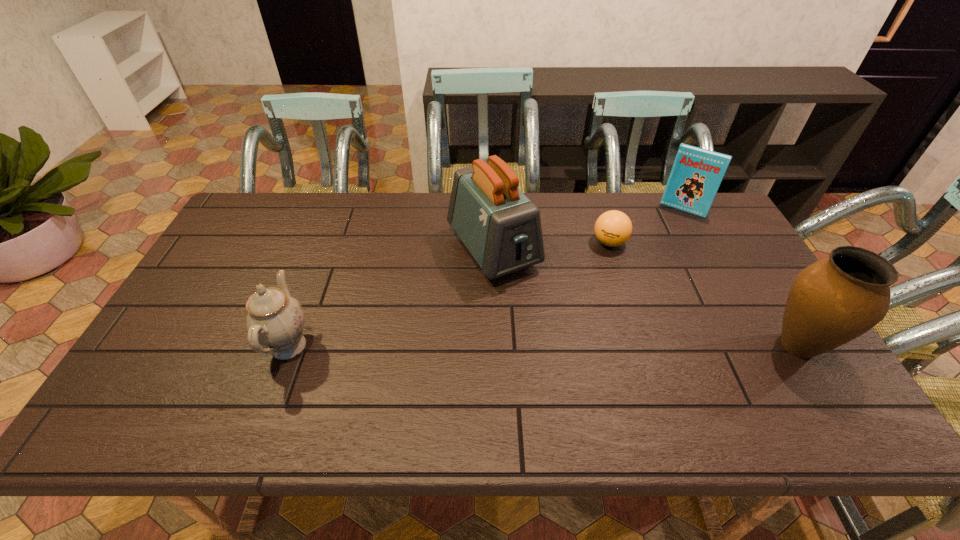
Image resolution: width=960 pixels, height=540 pixels. Find the location of `the leftmost object`. the leftmost object is located at coordinates click(274, 319).

The image size is (960, 540). Identify the location of urn. (831, 302).

The width and height of the screenshot is (960, 540). Find the location of `the shortest object`. the shortest object is located at coordinates (613, 228).

What are the coordinates of `the third object from left to right` in the screenshot? It's located at (613, 228).

Where is `the fourth object from right to left`? This screenshot has width=960, height=540. the fourth object from right to left is located at coordinates (499, 225).

I want to click on book, so click(x=697, y=173).

The height and width of the screenshot is (540, 960). What are the coordinates of `free space located 0.280m on the spout of the leftmost object` in the screenshot? It's located at (153, 346).

Find the location of a particular element. The width and height of the screenshot is (960, 540). vacant space located on the spout of the leftmost object is located at coordinates (164, 346).

Find the location of a particular element. The image size is (960, 540). free space located on the spout of the leftmost object is located at coordinates (224, 346).

This screenshot has height=540, width=960. I want to click on free location located 0.390m on the back of the urn, so click(724, 227).